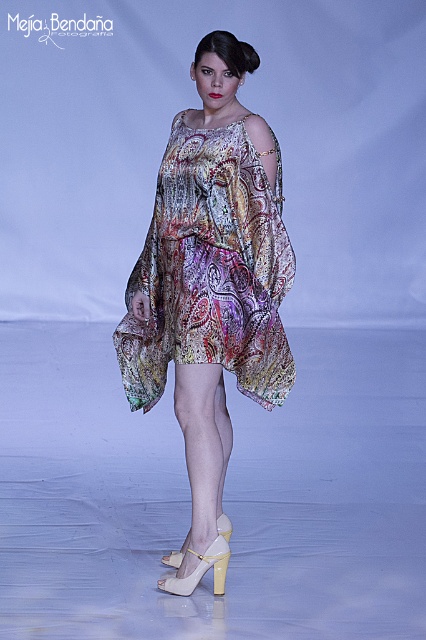
Question: Is the position of multicolored sheer dress at center less distant than that of white leather high-heeled shoe at center?

Choices:
 (A) no
 (B) yes

Answer: (B)

Question: Can you confirm if multicolored sheer dress at center is bigger than white leather high-heeled shoe at center?

Choices:
 (A) yes
 (B) no

Answer: (A)

Question: Considering the real-world distances, which object is farthest from the multicolored sheer dress at center?

Choices:
 (A) white leather sandal at center
 (B) white leather high-heeled shoe at center

Answer: (B)

Question: Does multicolored sheer dress at center have a smaller size compared to white leather high-heeled shoe at center?

Choices:
 (A) yes
 (B) no

Answer: (B)

Question: Estimate the real-world distances between objects in this image. Which object is closer to the white leather high-heeled shoe at center?

Choices:
 (A) white leather sandal at center
 (B) multicolored sheer dress at center

Answer: (A)

Question: Which is nearer to the multicolored sheer dress at center?

Choices:
 (A) white leather high-heeled shoe at center
 (B) white leather sandal at center

Answer: (B)